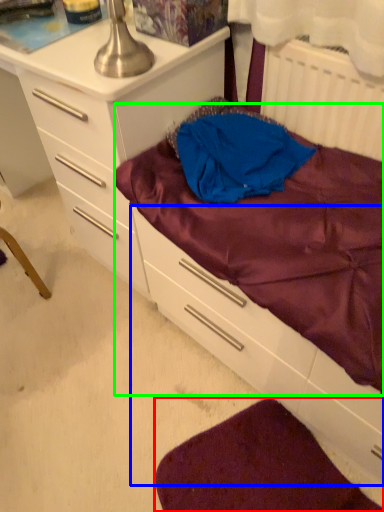
Question: Which object is the closest to the sheet (highlighted by a red box)? Choose among these: drawer (highlighted by a blue box) or mattress (highlighted by a green box).

Choices:
 (A) drawer
 (B) mattress

Answer: (A)